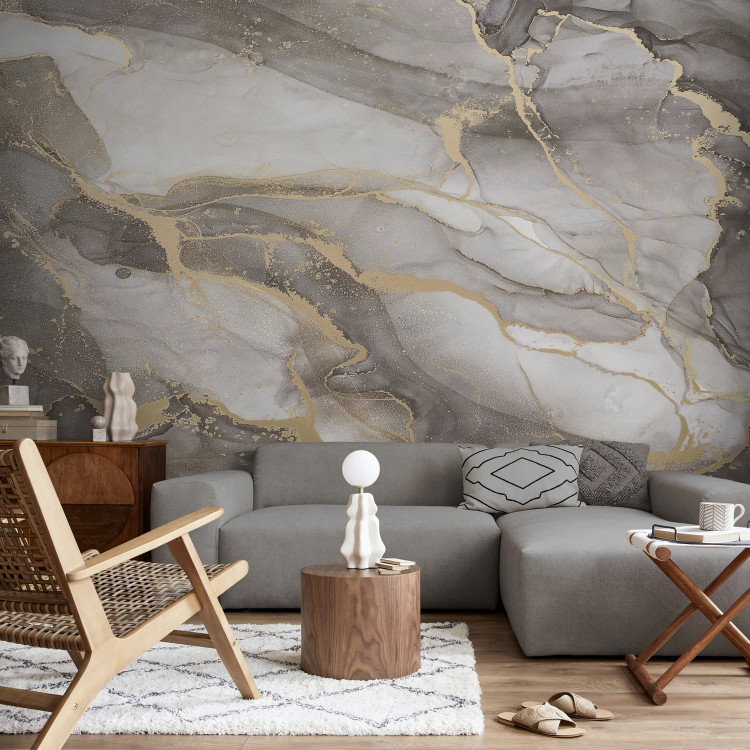
What are the coordinates of `2 colors on rug` in the screenshot? It's located at (406, 712), (454, 721).